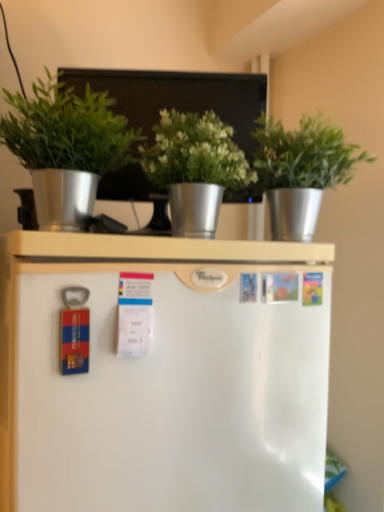
Question: Is green metallic pot at center, which is the 2th houseplant from right to left, at the back of metallic silver pot at upper center, which is the 1th houseplant in right-to-left order?

Choices:
 (A) yes
 (B) no

Answer: (B)

Question: Does metallic silver pot at upper center, which is the 3th houseplant from left to right, appear on the right side of green metallic pot at center, placed as the second houseplant when sorted from left to right?

Choices:
 (A) yes
 (B) no

Answer: (A)

Question: Does metallic silver pot at upper center, which is the 3th houseplant from left to right, come behind green metallic pot at center, placed as the second houseplant when sorted from left to right?

Choices:
 (A) no
 (B) yes

Answer: (B)

Question: Considering the relative sizes of metallic silver pot at upper center, which is the 1th houseplant in right-to-left order, and green metallic pot at center, which is the 2th houseplant from right to left, in the image provided, is metallic silver pot at upper center, which is the 1th houseplant in right-to-left order, taller than green metallic pot at center, which is the 2th houseplant from right to left,?

Choices:
 (A) yes
 (B) no

Answer: (A)

Question: Are metallic silver pot at upper center, which is the 1th houseplant in right-to-left order, and green metallic pot at center, which is the 2th houseplant from right to left, located far from each other?

Choices:
 (A) no
 (B) yes

Answer: (A)

Question: From a real-world perspective, is metallic silver pot at upper center, which is the 1th houseplant in right-to-left order, over green metallic pot at center, which is the 2th houseplant from right to left?

Choices:
 (A) yes
 (B) no

Answer: (A)

Question: Is green metallic pot at center, placed as the second houseplant when sorted from left to right, positioned before green matte plant at upper left, the 3th houseplant when ordered from right to left?

Choices:
 (A) yes
 (B) no

Answer: (B)

Question: Is green metallic pot at center, which is the 2th houseplant from right to left, thinner than green matte plant at upper left, arranged as the 1th houseplant when viewed from the left?

Choices:
 (A) no
 (B) yes

Answer: (A)

Question: Does green metallic pot at center, placed as the second houseplant when sorted from left to right, appear on the left side of green matte plant at upper left, the 3th houseplant when ordered from right to left?

Choices:
 (A) no
 (B) yes

Answer: (A)

Question: Does green metallic pot at center, which is the 2th houseplant from right to left, have a smaller size compared to green matte plant at upper left, arranged as the 1th houseplant when viewed from the left?

Choices:
 (A) yes
 (B) no

Answer: (A)

Question: Is green metallic pot at center, which is the 2th houseplant from right to left, facing towards green matte plant at upper left, the 3th houseplant when ordered from right to left?

Choices:
 (A) yes
 (B) no

Answer: (B)

Question: Does green metallic pot at center, which is the 2th houseplant from right to left, come behind green matte plant at upper left, arranged as the 1th houseplant when viewed from the left?

Choices:
 (A) yes
 (B) no

Answer: (A)

Question: Is metallic silver bulletin board at upper center located outside metallic silver pot at upper center, which is the 3th houseplant from left to right?

Choices:
 (A) no
 (B) yes

Answer: (B)